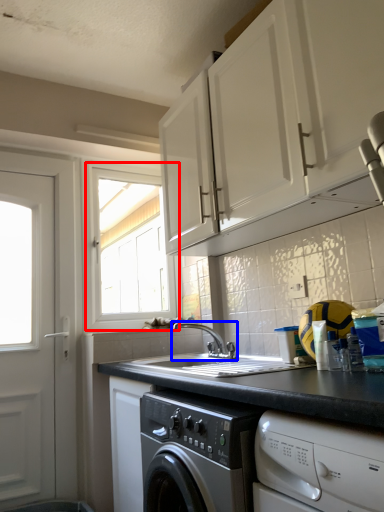
Question: Which of the following is the farthest to the observer, window (highlighted by a red box) or tap (highlighted by a blue box)?

Choices:
 (A) window
 (B) tap

Answer: (A)